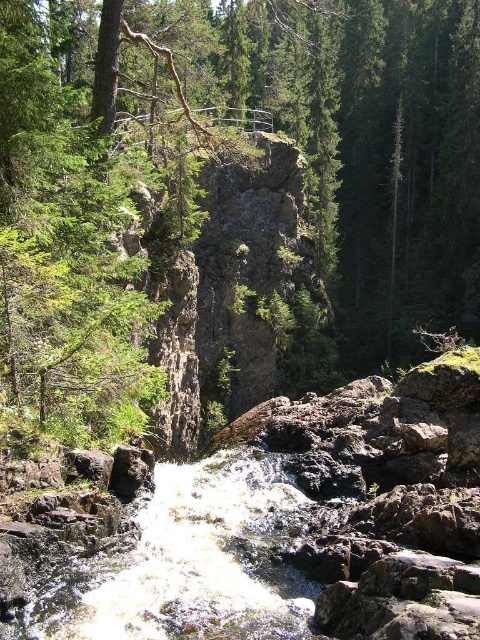
Question: Is green rough tree at center smaller than white frothy water at center?

Choices:
 (A) yes
 (B) no

Answer: (B)

Question: Can you confirm if green rough tree at center is positioned to the left of white frothy water at center?

Choices:
 (A) no
 (B) yes

Answer: (A)

Question: Is green rough tree at center further to the viewer compared to white frothy water at center?

Choices:
 (A) yes
 (B) no

Answer: (A)